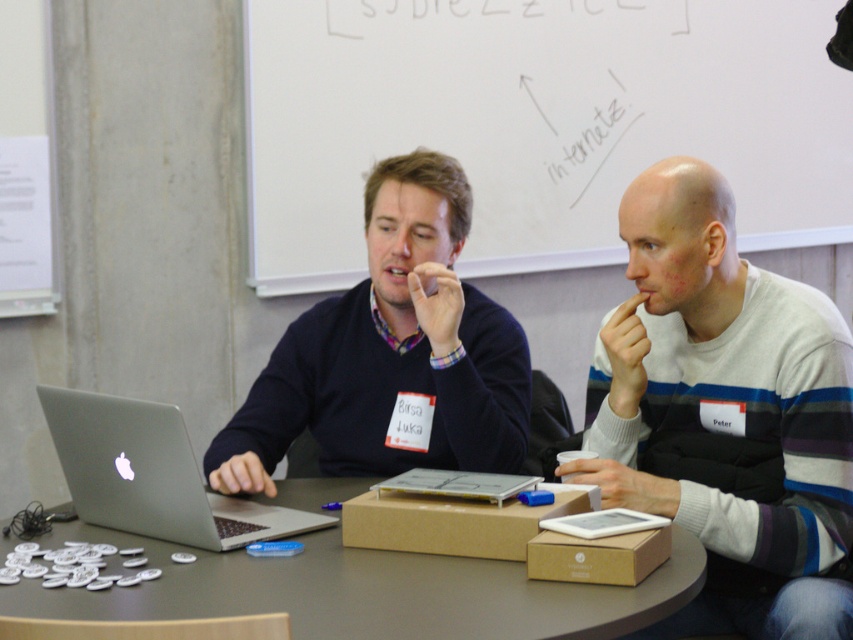
Question: Does whiteboard at upper center have a smaller size compared to white striped sweater at center?

Choices:
 (A) yes
 (B) no

Answer: (B)

Question: Which of the following is the farthest from the observer?

Choices:
 (A) silver metallic laptop at center
 (B) matte brown cardboard box at center

Answer: (A)

Question: Is silver metallic laptop at center to the left of brown cardboard box at lower center from the viewer's perspective?

Choices:
 (A) yes
 (B) no

Answer: (A)

Question: Is matte black sweater at center above silver metallic laptop at center?

Choices:
 (A) no
 (B) yes

Answer: (B)

Question: Which object is positioned farthest from the matte black sweater at center?

Choices:
 (A) white striped sweater at center
 (B) brown cardboard box at center
 (C) matte brown cardboard box at center

Answer: (A)

Question: Among these points, which one is farthest from the camera?

Choices:
 (A) (418, 442)
 (B) (80, 525)
 (C) (537, 512)

Answer: (A)